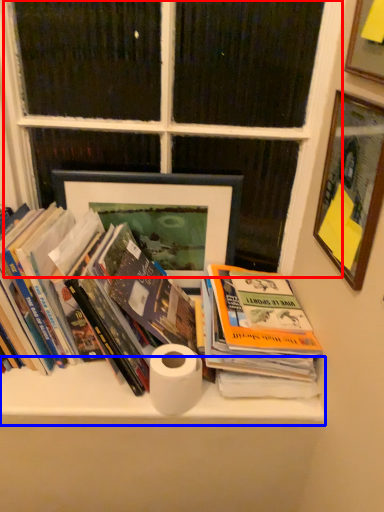
Question: Which object is further to the camera taking this photo, window frame (highlighted by a red box) or shelf (highlighted by a blue box)?

Choices:
 (A) window frame
 (B) shelf

Answer: (B)